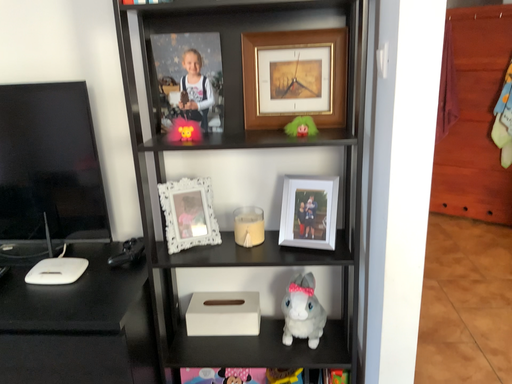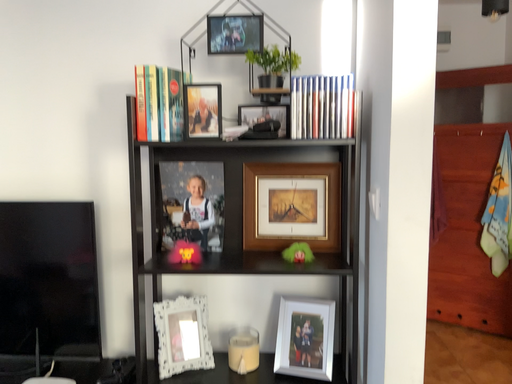
Question: How did the camera likely rotate when shooting the video?

Choices:
 (A) rotated downward
 (B) rotated upward

Answer: (B)